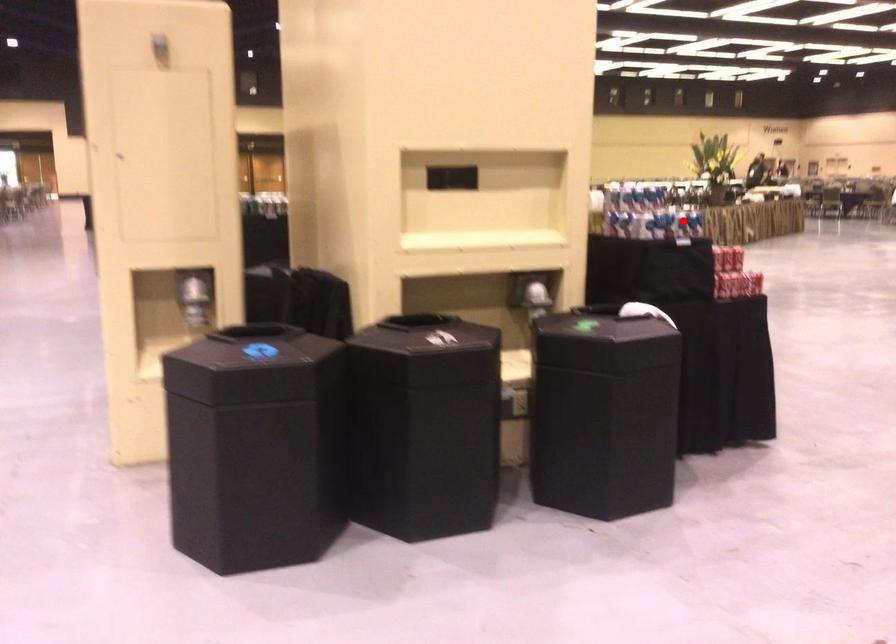
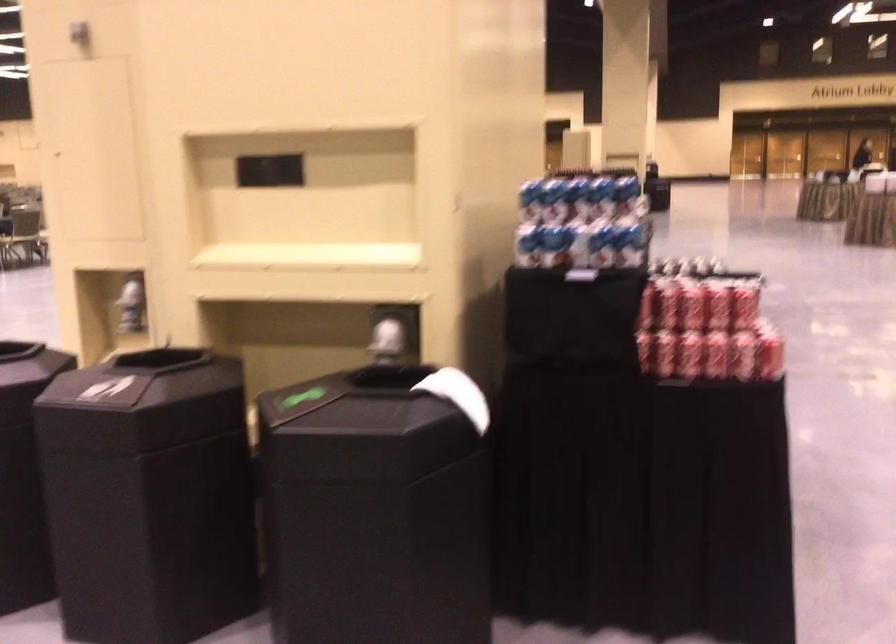
The point at the highlighted location is marked in the first image. Where is the corresponding point in the second image?

(576, 247)